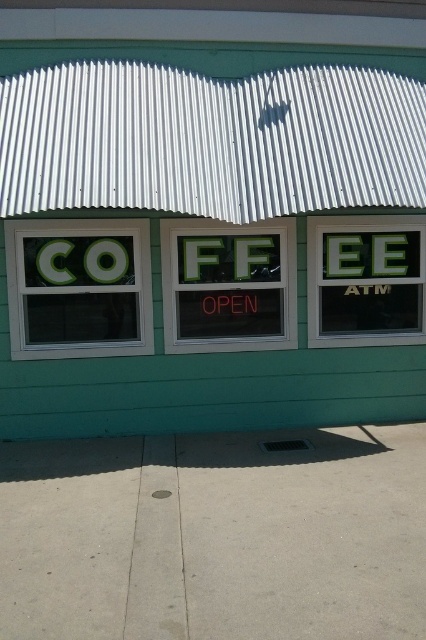
You are standing in front of the building and want to read the text on the green plastic sign at left and the green glass window at center. Which one is easier to read from your current position?

The green glass window at center is easier to read because it is larger than the green plastic sign at left.

You are standing in front of the building and want to read the words on the green matte signboard at center and the green glass window at center. Which one do you think is easier to read from your current position?

The green matte signboard at center is bigger than the green glass window at center, so it is easier to read from your current position.